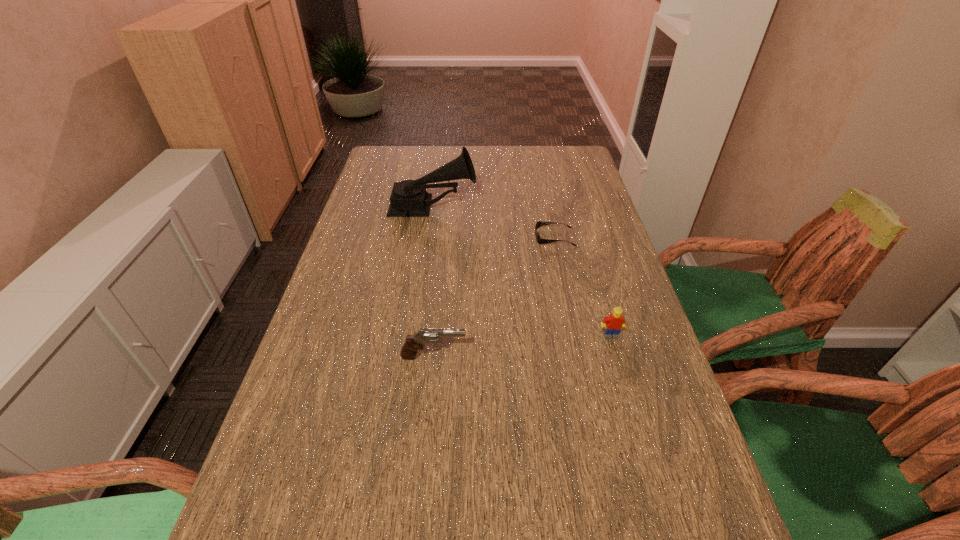
You are a GUI agent. You are given a task and a screenshot of the screen. Output one action in this format:
    pyautogui.click(x=<x>, y=<y>)
    Task: Click on the blank region between the third nearest object and the Lego
    This screenshot has height=540, width=960.
    Given the screenshot: What is the action you would take?
    pyautogui.click(x=583, y=286)

Locate an element on the screen. Image resolution: width=960 pixels, height=540 pixels. vacant area that lies between the Lego and the shortest object is located at coordinates (583, 286).

What are the coordinates of `free space between the second nearest object and the tallest object` in the screenshot? It's located at (522, 272).

Where is `empty space that is in between the pistol and the shortest object`? Image resolution: width=960 pixels, height=540 pixels. empty space that is in between the pistol and the shortest object is located at coordinates (494, 297).

The height and width of the screenshot is (540, 960). Identify the location of free space between the sunglasses and the phonograph_record. (493, 222).

The height and width of the screenshot is (540, 960). I want to click on free space between the shortest object and the pistol, so click(x=494, y=297).

The image size is (960, 540). In order to click on free spot between the third farthest object and the nearest object in this screenshot , I will do `click(522, 346)`.

In order to click on free spot between the farthest object and the sunglasses in this screenshot , I will do `click(493, 222)`.

The height and width of the screenshot is (540, 960). Identify the location of vacant region between the Lego and the tallest object. (522, 272).

Select which object appears as the closest to the farthest object. Please provide its 2D coordinates. Your answer should be formatted as a tuple, i.e. [(x, y)], where the tuple contains the x and y coordinates of a point satisfying the conditions above.

[(540, 241)]